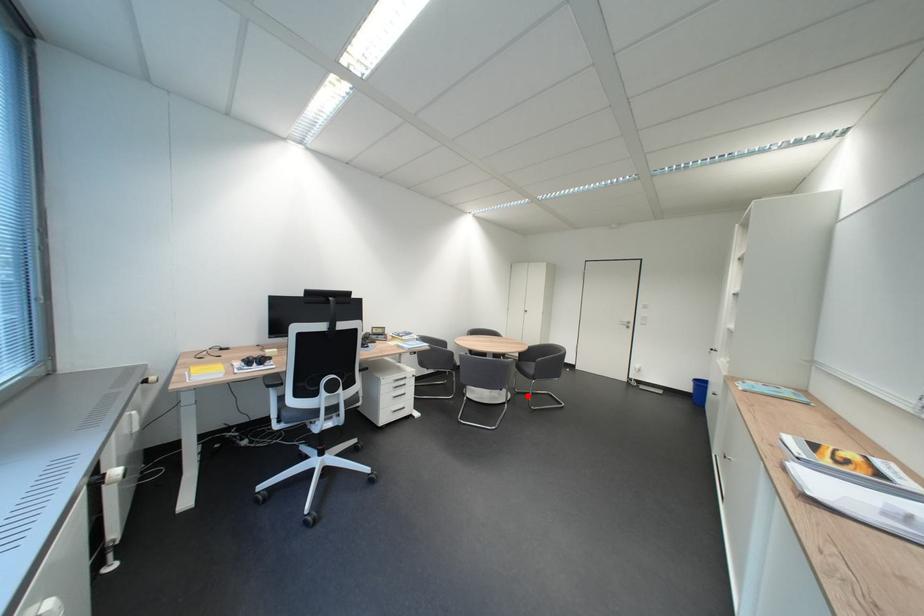
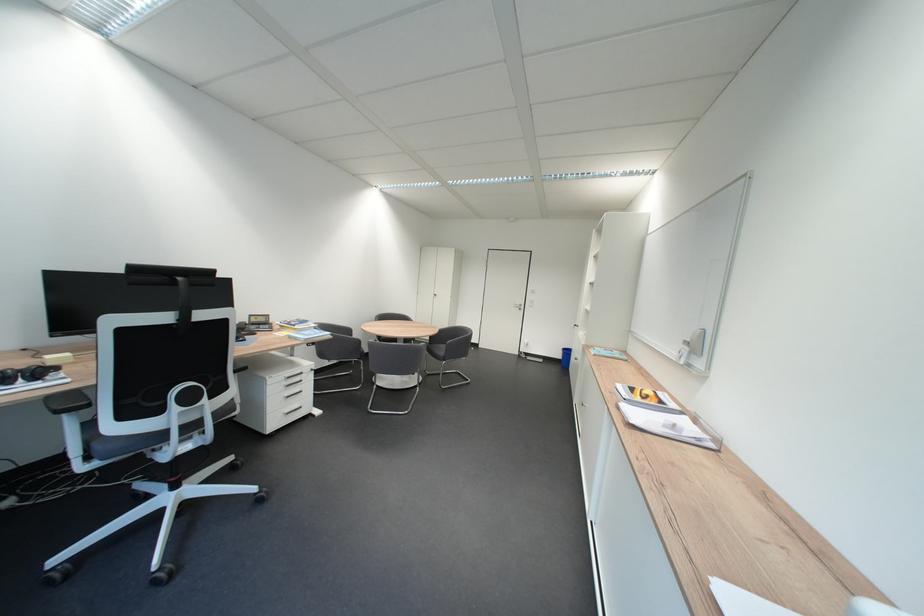
Locate, in the second image, the point that corresponds to the highlighted location in the first image.

(439, 378)